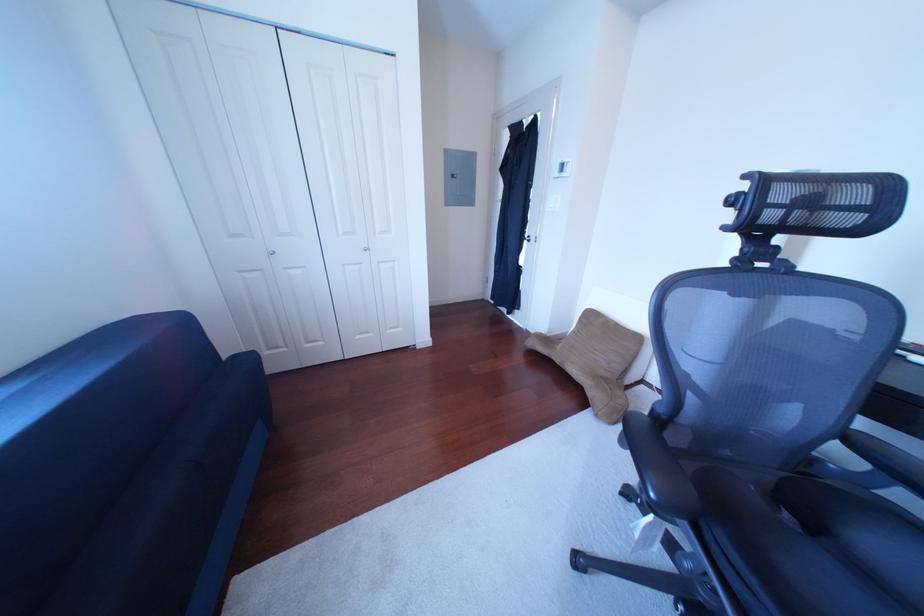
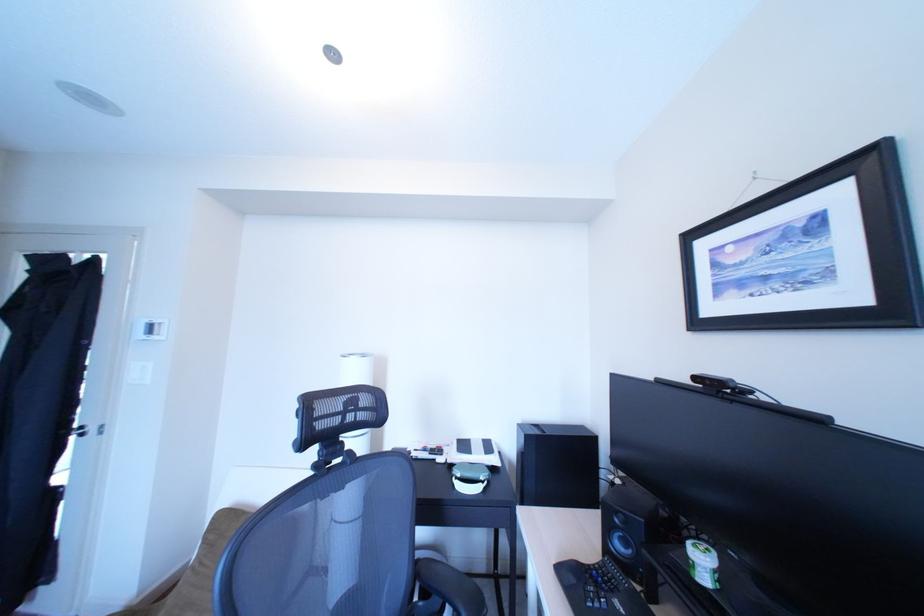
Question: The images are taken continuously from a first-person perspective. In which direction is your viewpoint rotating?

Choices:
 (A) Left
 (B) Right
 (C) Up
 (D) Down

Answer: (B)